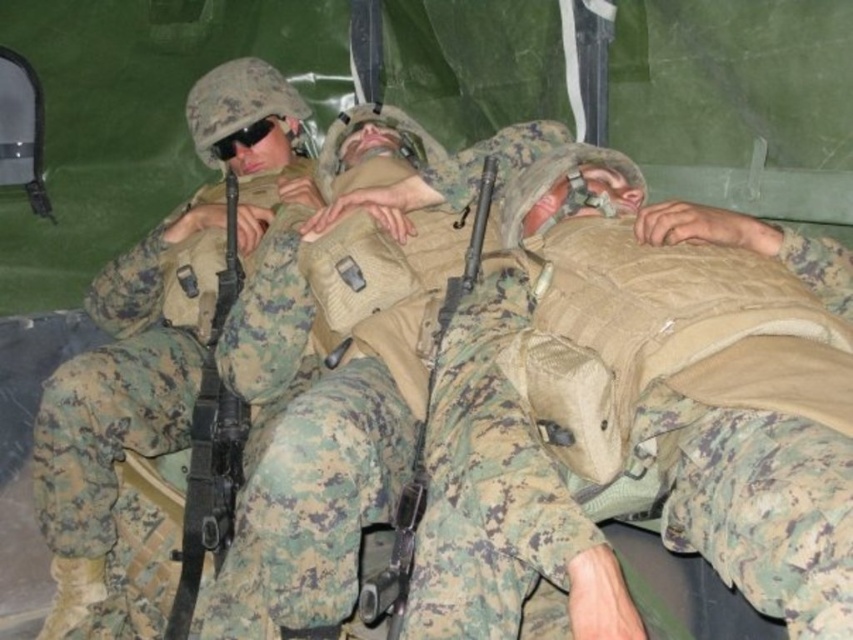
Question: Is camouflage uniform at left below matte black rifle at left?

Choices:
 (A) yes
 (B) no

Answer: (B)

Question: Which point is farther from the camera taking this photo?

Choices:
 (A) (251, 308)
 (B) (399, 520)
 (C) (213, 536)

Answer: (C)

Question: Which point is closer to the camera?

Choices:
 (A) matte black rifle at center
 (B) black matte goggles at upper center
 (C) matte black rifle at left
 (D) camouflage uniform at left

Answer: (A)

Question: Considering the relative positions of matte black rifle at left and black matte goggles at upper center in the image provided, where is matte black rifle at left located with respect to black matte goggles at upper center?

Choices:
 (A) right
 (B) left

Answer: (A)

Question: Is camouflage uniform at left wider than matte black rifle at left?

Choices:
 (A) no
 (B) yes

Answer: (B)

Question: Which point is closer to the camera?

Choices:
 (A) (219, 150)
 (B) (218, 476)

Answer: (B)